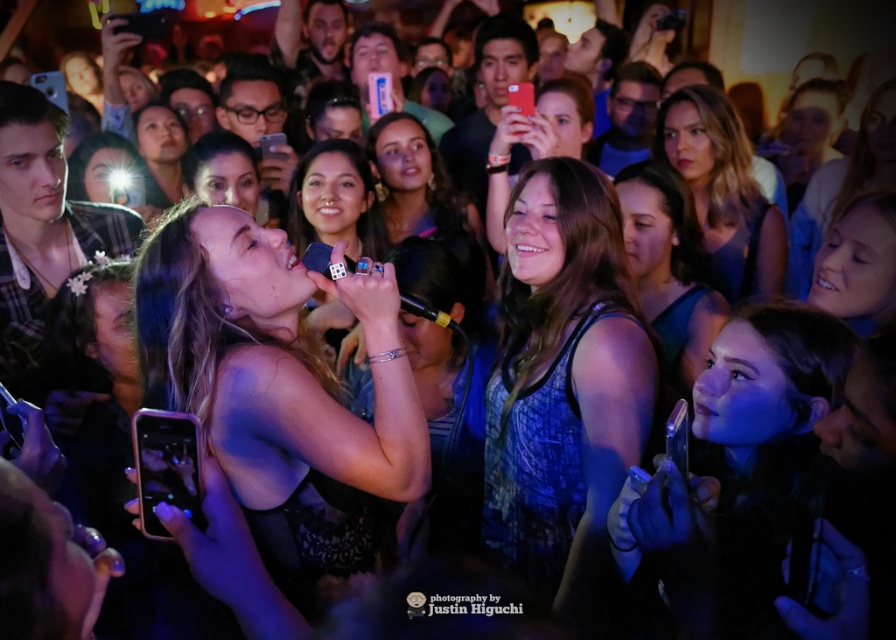
Question: Is blonde hair at upper center to the right of matte skin tone face at center from the viewer's perspective?

Choices:
 (A) no
 (B) yes

Answer: (B)

Question: Based on their relative distances, which object is nearer to the matte skin tone face at center?

Choices:
 (A) satin black microphone at center
 (B) blonde hair at upper center
 (C) smooth black hair at center
 (D) matte black tank top at center

Answer: (B)

Question: Which point appears closest to the camera in this image?

Choices:
 (A) (600, 474)
 (B) (683, 266)
 (C) (159, 284)

Answer: (C)

Question: In this image, where is matte blue dress at center located relative to smooth skin face at upper right?

Choices:
 (A) right
 (B) left

Answer: (B)

Question: Among these objects, which one is nearest to the camera?

Choices:
 (A) matte blue dress at center
 (B) matte black tank top at center
 (C) blonde hair at upper center

Answer: (B)

Question: Is matte black tank top at center closer to camera compared to matte skin tone face at center?

Choices:
 (A) no
 (B) yes

Answer: (B)